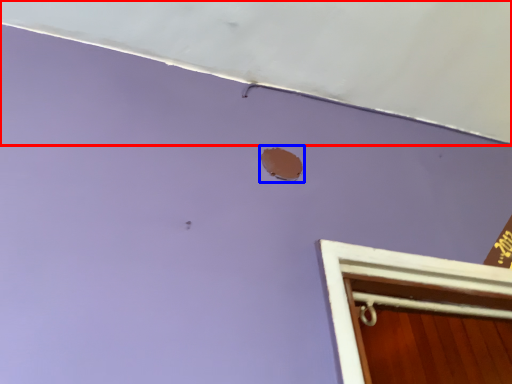
Question: Among these objects, which one is farthest to the camera, exhaust hood (highlighted by a red box) or hole (highlighted by a blue box)?

Choices:
 (A) exhaust hood
 (B) hole

Answer: (B)